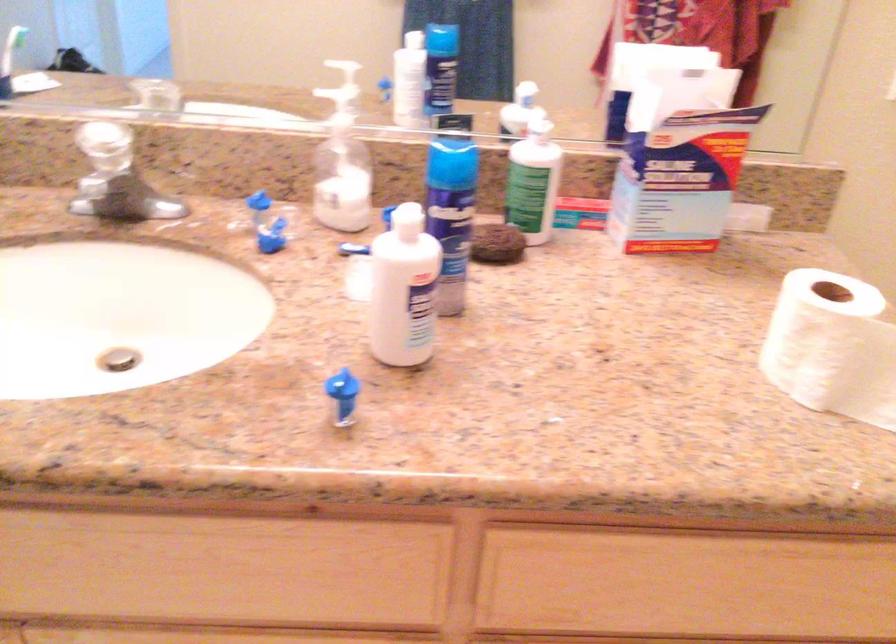
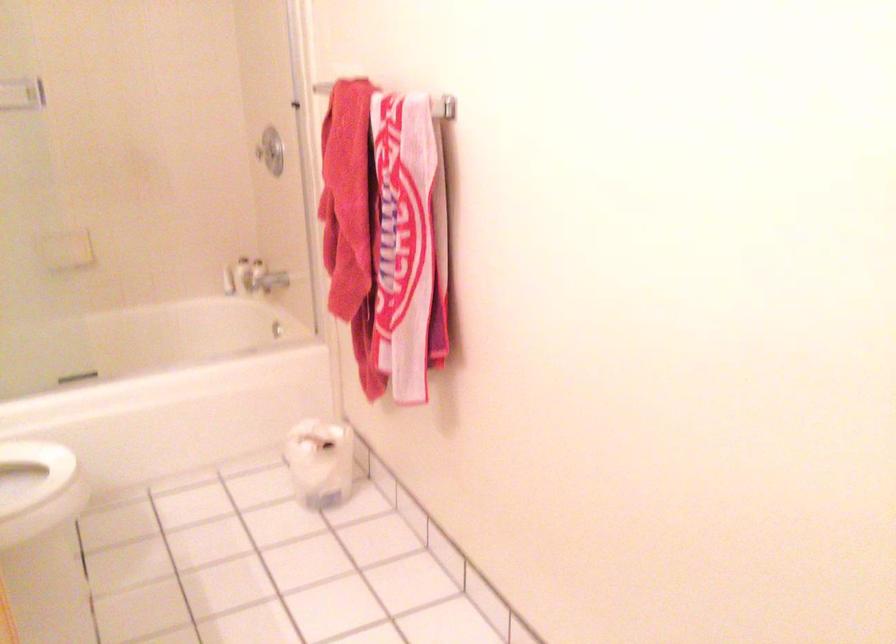
How did the camera likely rotate?

The camera's rotation is toward right-down.